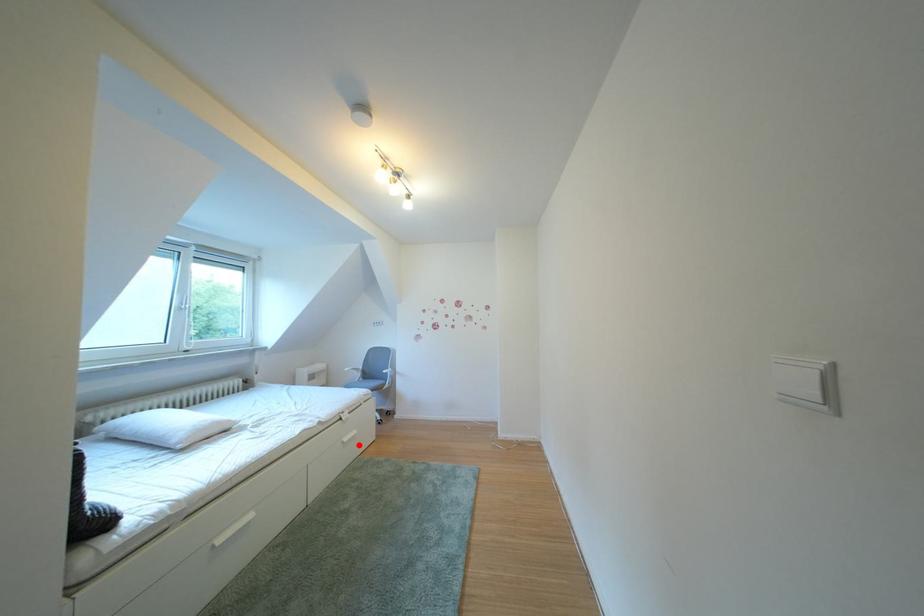
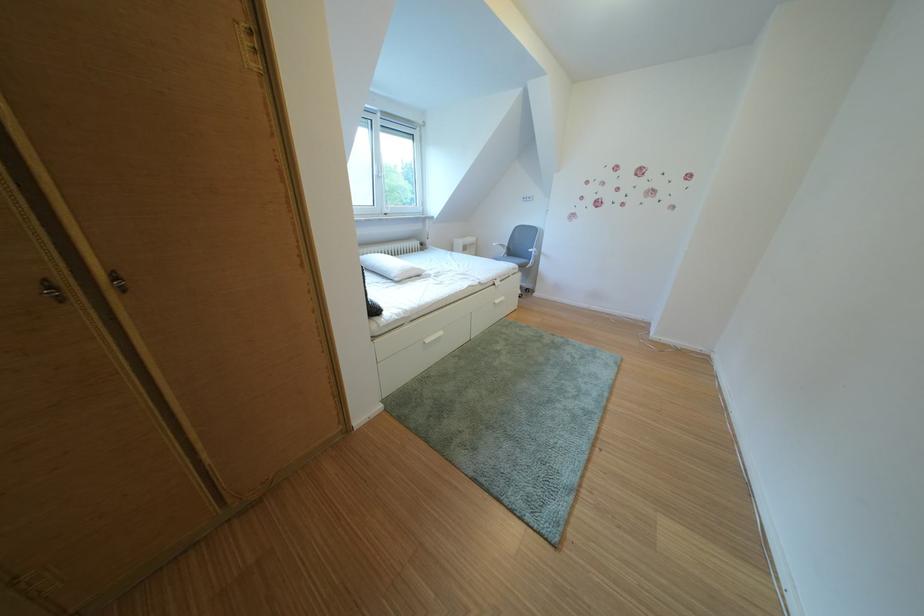
Question: I am providing you with two images of the same scene from different viewpoints. A red point is marked on the first image. Is the red point's position out of view in image 2?

Choices:
 (A) Yes
 (B) No

Answer: (B)